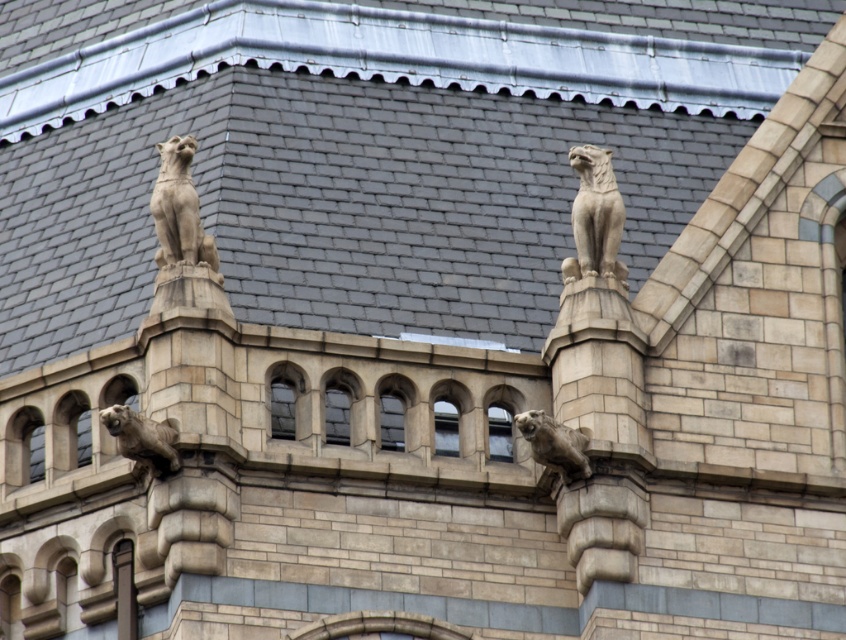
Does matte stone cat at upper left have a greater width compared to matte stone gargoyle at center?

Indeed, matte stone cat at upper left has a greater width compared to matte stone gargoyle at center.

Based on the photo, is matte stone cat at upper left further to the viewer compared to matte stone gargoyle at center?

Yes.

Does point (157, 188) lie behind point (108, 429)?

Yes, point (157, 188) is behind point (108, 429).

I want to click on matte stone cat at upper left, so click(x=179, y=209).

Does stone tiger at upper right have a larger size compared to matte stone gargoyle at center?

Yes, stone tiger at upper right is bigger than matte stone gargoyle at center.

Locate an element on the screen. The image size is (846, 640). stone tiger at upper right is located at coordinates (595, 216).

Where is `gray stone roof at upper center`? gray stone roof at upper center is located at coordinates (365, 152).

What do you see at coordinates (365, 152) in the screenshot? I see `gray stone roof at upper center` at bounding box center [365, 152].

Find the location of a particular element. The width and height of the screenshot is (846, 640). gray stone roof at upper center is located at coordinates (365, 152).